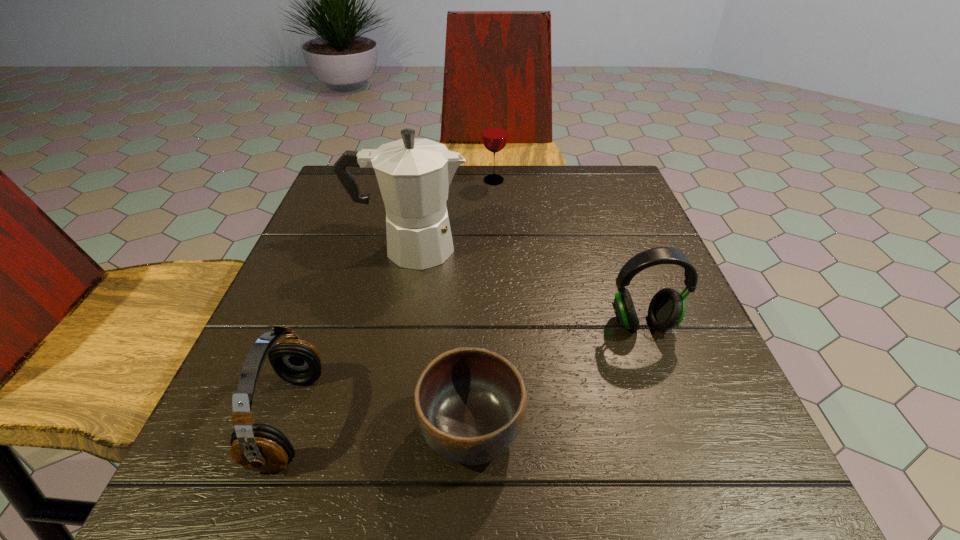
You are a GUI agent. You are given a task and a screenshot of the screen. Output one action in this format:
    pyautogui.click(x=<x>, y=<y>)
    Task: Click on the vacant space in between the bowl and the left headset
    This screenshot has width=960, height=540.
    Given the screenshot: What is the action you would take?
    pyautogui.click(x=380, y=425)

Find the location of `unoccupied area between the fourth nearest object and the farther headset`. unoccupied area between the fourth nearest object and the farther headset is located at coordinates (526, 286).

Identify the location of empty space between the farthest object and the farther headset. This screenshot has width=960, height=540. (567, 252).

In order to click on empty location between the left headset and the bowl in this screenshot , I will do `click(380, 425)`.

Identify the location of free space between the nearer headset and the shortest object. (380, 425).

Select which object appears as the closest to the coffeepot. Please provide its 2D coordinates. Your answer should be formatted as a tuple, i.e. [(x, y)], where the tuple contains the x and y coordinates of a point satisfying the conditions above.

[(494, 136)]

Locate which object is the closest to the fourth nearest object. Please provide its 2D coordinates. Your answer should be formatted as a tuple, i.e. [(x, y)], where the tuple contains the x and y coordinates of a point satisfying the conditions above.

[(494, 136)]

At what (x,y) coordinates should I click in order to perform the action: click on free space that satisfies the following two spatial constraints: 1. on the ear cups of the farther headset; 2. on the ear cups of the left headset. Please return your answer as a coordinate pair (x, y). Looking at the image, I should click on (677, 419).

Where is `free spot that satisfies the following two spatial constraints: 1. on the ear cups of the left headset; 2. on the back side of the shortest object`? The height and width of the screenshot is (540, 960). free spot that satisfies the following two spatial constraints: 1. on the ear cups of the left headset; 2. on the back side of the shortest object is located at coordinates (286, 430).

Image resolution: width=960 pixels, height=540 pixels. Identify the location of vacant point that satisfies the following two spatial constraints: 1. on the ear cups of the bowl; 2. on the right side of the left headset. (286, 430).